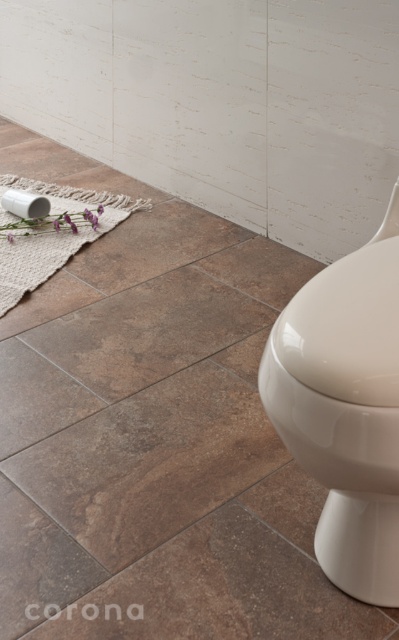
You are standing in the bathroom and want to place a small plant pot exactly where the brown textured tile at lower left is located. According to the image, what are the coordinates of the spot where you should place the plant pot?

The coordinates for the brown textured tile at lower left are at point (37, 563).

You are designing a bathroom layout and want to ensure the glossy ceramic toilet bowl at lower right and the purple matte flower at lower left are appropriately sized. Which object is larger?

The glossy ceramic toilet bowl at lower right is bigger than the purple matte flower at lower left.

You are standing in the bathroom and need to determine which object is taller between the glossy ceramic toilet bowl at lower right and the purple matte flower at lower left. Can you identify the taller one?

The glossy ceramic toilet bowl at lower right is taller than the purple matte flower at lower left according to the description.